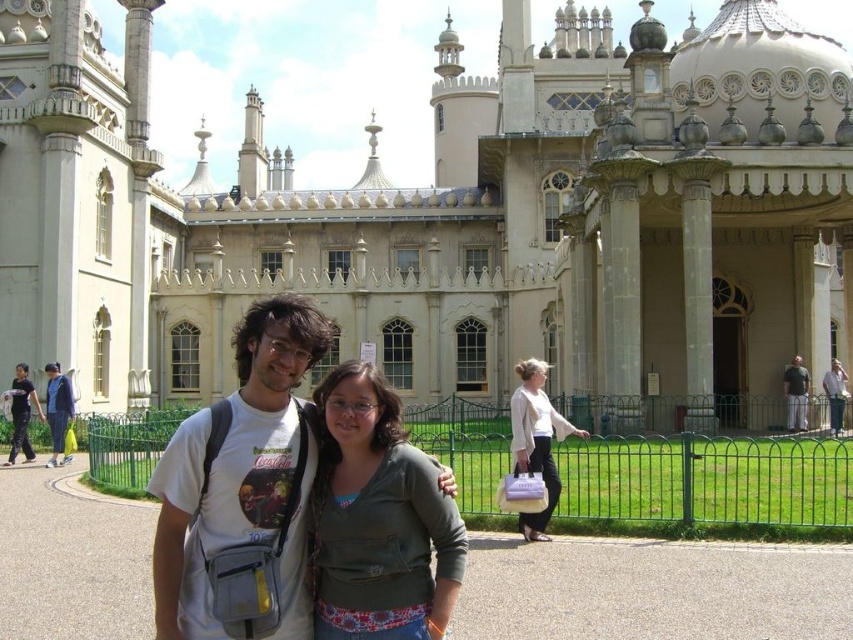
Measure the distance between white cotton t-shirt at center and camera.

white cotton t-shirt at center and camera are 108.99 feet apart from each other.

Between white cotton t-shirt at center and matte green sweater at center, which one is positioned lower?

Positioned lower is matte green sweater at center.

Is point (254, 387) farther from camera compared to point (351, 438)?

No, it is not.

Where is `white cotton t-shirt at center`? The width and height of the screenshot is (853, 640). white cotton t-shirt at center is located at coordinates (242, 486).

Looking at this image, who is higher up, white cotton sweater at center or matte white t-shirt at left?

white cotton sweater at center

Can you confirm if white cotton sweater at center is taller than matte white t-shirt at left?

Yes, white cotton sweater at center is taller than matte white t-shirt at left.

Who is more forward, (x=531, y=385) or (x=25, y=436)?

Positioned in front is point (x=531, y=385).

Find the location of a particular element. Image resolution: width=853 pixels, height=640 pixels. white cotton sweater at center is located at coordinates (537, 440).

Does denim jacket at left appear on the left side of matte white t-shirt at left?

No, denim jacket at left is not to the left of matte white t-shirt at left.

Is point (51, 401) more distant than point (24, 410)?

That is True.

Locate an element on the screen. This screenshot has height=640, width=853. denim jacket at left is located at coordinates (57, 410).